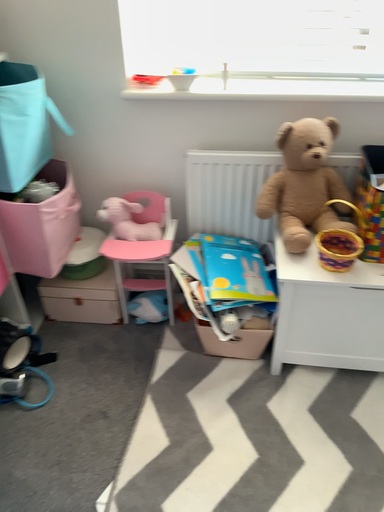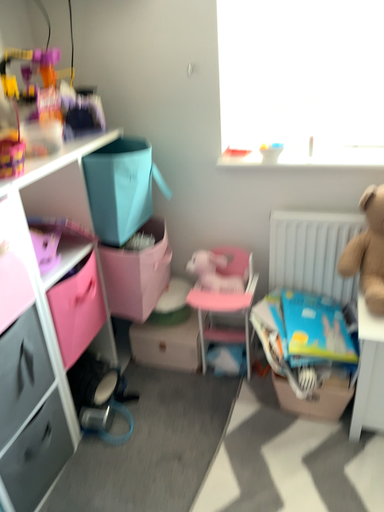
Question: Which way did the camera rotate in the video?

Choices:
 (A) rotated downward
 (B) rotated upward

Answer: (B)